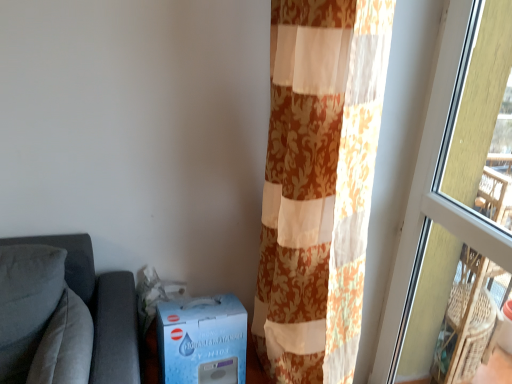
Question: Is transparent glass window at right smaller than suede-like gray pillow at left?

Choices:
 (A) no
 (B) yes

Answer: (A)

Question: Considering the relative sizes of transparent glass window at right and suede-like gray pillow at left in the image provided, is transparent glass window at right shorter than suede-like gray pillow at left?

Choices:
 (A) no
 (B) yes

Answer: (A)

Question: Does transparent glass window at right come in front of suede-like gray pillow at left?

Choices:
 (A) yes
 (B) no

Answer: (A)

Question: From the image's perspective, is transparent glass window at right located above suede-like gray pillow at left?

Choices:
 (A) yes
 (B) no

Answer: (A)

Question: Does transparent glass window at right come behind suede-like gray pillow at left?

Choices:
 (A) no
 (B) yes

Answer: (A)

Question: From the image's perspective, is transparent glass window at right below suede-like gray pillow at left?

Choices:
 (A) no
 (B) yes

Answer: (A)

Question: From the image's perspective, is suede-like gray pillow at left located beneath blue cardboard box at lower left?

Choices:
 (A) no
 (B) yes

Answer: (B)

Question: Can you confirm if suede-like gray pillow at left is positioned to the left of blue cardboard box at lower left?

Choices:
 (A) yes
 (B) no

Answer: (A)

Question: Considering the relative sizes of suede-like gray pillow at left and blue cardboard box at lower left in the image provided, is suede-like gray pillow at left smaller than blue cardboard box at lower left?

Choices:
 (A) yes
 (B) no

Answer: (B)

Question: Is suede-like gray pillow at left not close to blue cardboard box at lower left?

Choices:
 (A) yes
 (B) no

Answer: (B)

Question: Is suede-like gray pillow at left wider than blue cardboard box at lower left?

Choices:
 (A) yes
 (B) no

Answer: (A)

Question: Is suede-like gray pillow at left oriented towards blue cardboard box at lower left?

Choices:
 (A) no
 (B) yes

Answer: (B)

Question: Is blue cardboard box at lower left oriented towards floral fabric curtain at right?

Choices:
 (A) yes
 (B) no

Answer: (B)